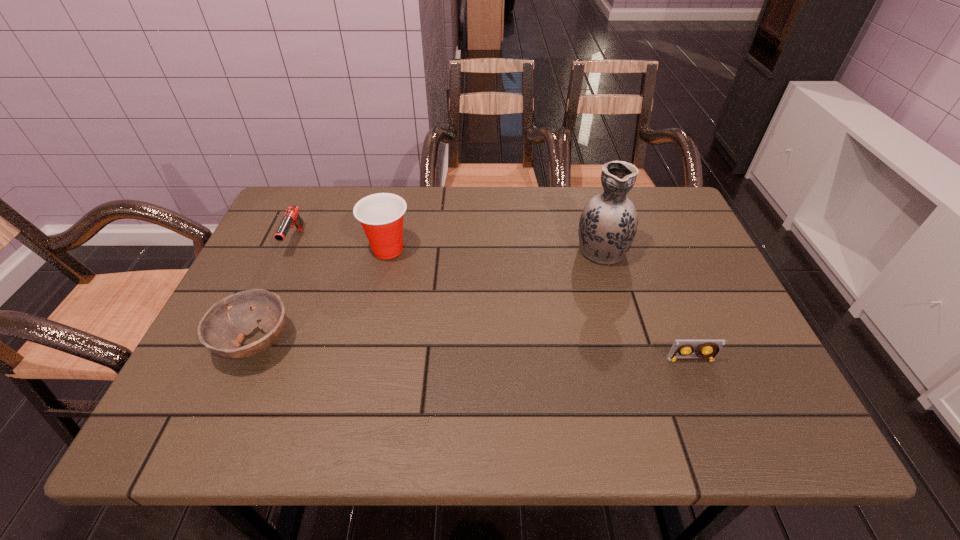
What are the coordinates of `vase` in the screenshot? It's located at (608, 223).

Locate an element on the screen. cup is located at coordinates (381, 215).

The width and height of the screenshot is (960, 540). I want to click on the third object from left to right, so click(381, 215).

You are a GUI agent. You are given a task and a screenshot of the screen. Output one action in this format:
    pyautogui.click(x=<x>, y=<y>)
    Task: Click on the gun
    The image size is (960, 540).
    Given the screenshot: What is the action you would take?
    pyautogui.click(x=291, y=217)

The width and height of the screenshot is (960, 540). Find the location of `bowl`. bowl is located at coordinates (222, 330).

Where is `videotape`? videotape is located at coordinates (707, 350).

At what (x,y) coordinates should I click in order to perform the action: click on vacant region located 0.220m with the handle on the side of the vase. Please return your answer as a coordinate pair (x, y). This screenshot has height=540, width=960. Looking at the image, I should click on (583, 186).

Where is `vacant space located 0.100m with the handle on the side of the vase`? The width and height of the screenshot is (960, 540). vacant space located 0.100m with the handle on the side of the vase is located at coordinates (589, 209).

You are a GUI agent. You are given a task and a screenshot of the screen. Output one action in this format:
    pyautogui.click(x=<x>, y=<y>)
    Task: Click on the vacant space located with the handle on the side of the vase
    This screenshot has height=540, width=960.
    Given the screenshot: What is the action you would take?
    pyautogui.click(x=588, y=205)

At what (x,y) coordinates should I click in order to perform the action: click on vacant area located on the front of the cup. Please return your answer as a coordinate pair (x, y). This screenshot has width=960, height=540. Looking at the image, I should click on (368, 340).